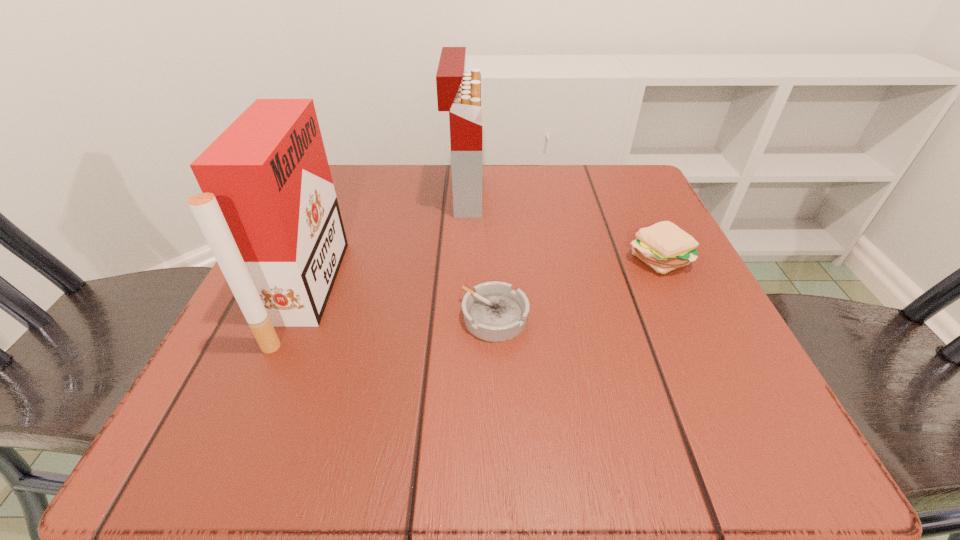
The width and height of the screenshot is (960, 540). I want to click on free location that satisfies the following two spatial constraints: 1. on the front side of the patty; 2. on the front-facing side of the left cigarette case, so click(x=674, y=292).

This screenshot has width=960, height=540. In order to click on vacant area in the image that satisfies the following two spatial constraints: 1. on the front-facing side of the nearer cigarette case; 2. on the left side of the shortest object in this screenshot , I will do `click(296, 317)`.

Locate an element on the screen. Image resolution: width=960 pixels, height=540 pixels. vacant position in the image that satisfies the following two spatial constraints: 1. with the lid open on the farthest object; 2. on the right side of the ashtray is located at coordinates (459, 317).

Where is `free space that satisfies the following two spatial constraints: 1. with the lid open on the farthest object; 2. on the left side of the ashtray`? The image size is (960, 540). free space that satisfies the following two spatial constraints: 1. with the lid open on the farthest object; 2. on the left side of the ashtray is located at coordinates (459, 317).